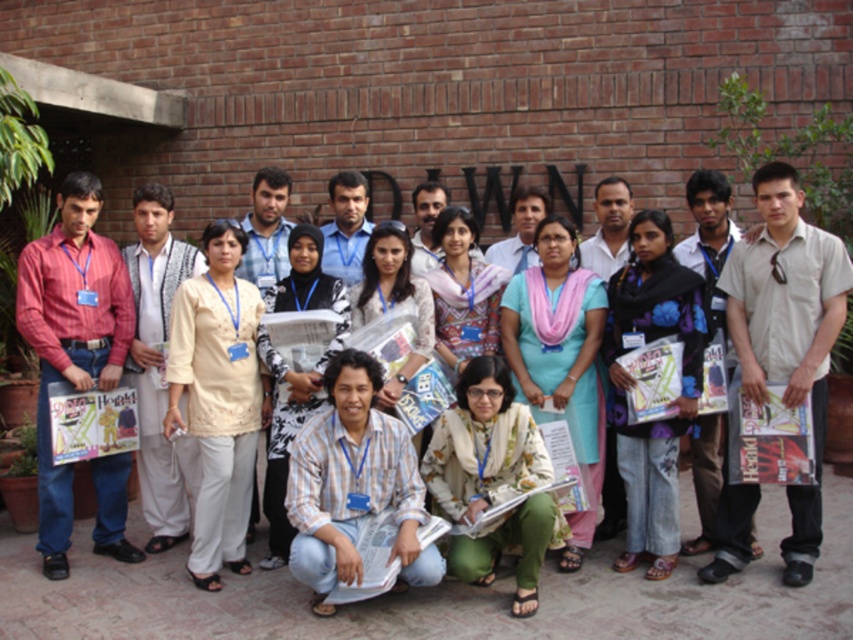
You are organizing a photo shoot and need to decide which item to feature more prominently in the foreground. Based on their widths, which object should you choose between the floral fabric scarf at center and the light blue fabric shirt at center?

The floral fabric scarf at center might be wider than light blue fabric shirt at center, so you should choose the floral fabric scarf at center for the foreground to emphasize its width.

You are taking a photo of the group in front of the brick wall. You want to focus on the point at the bottom right corner of the image. Which point, point [723,564] or point [480,264], is closer to the camera and should be in focus?

Point [723,564] is closer to the camera than point [480,264], so it should be in focus.